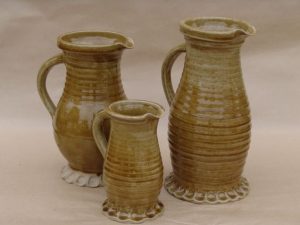
Identify the location of large pitcher base. (245, 28).